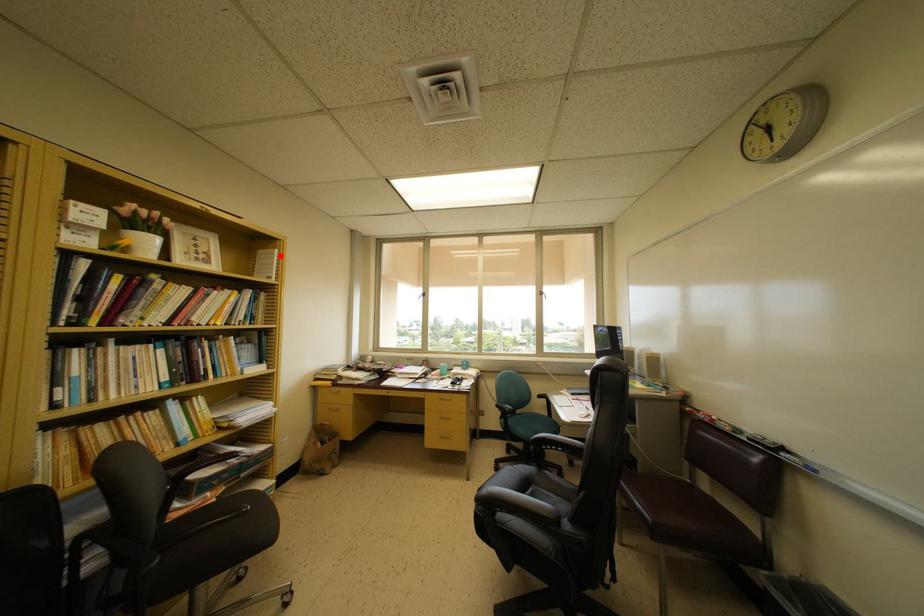
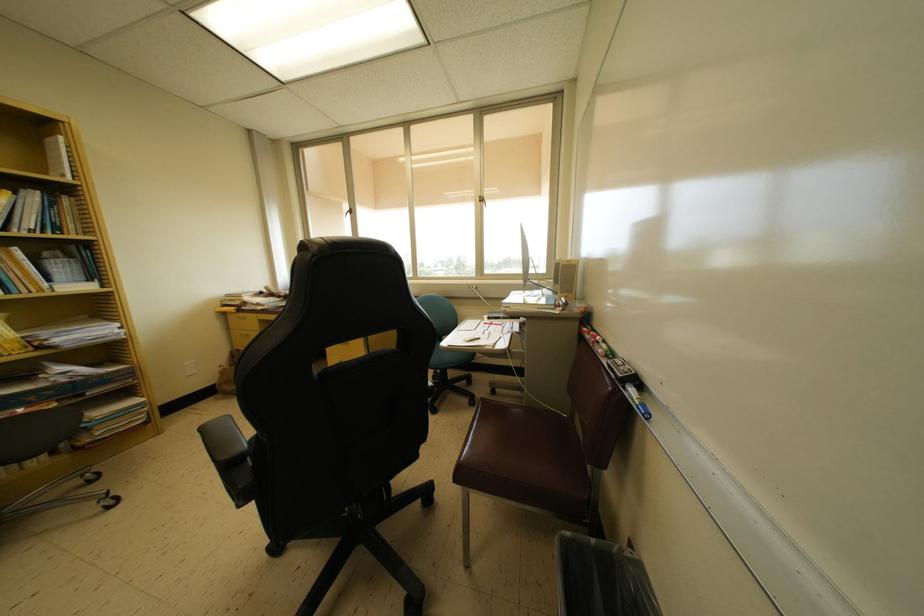
Locate, in the second image, the point that corresponds to the highlighted location in the first image.

(65, 143)